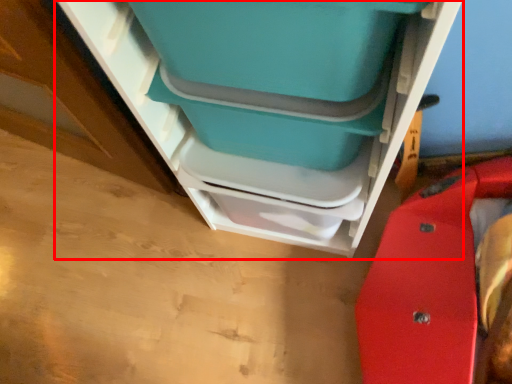
Question: Observing the image, what is the correct spatial positioning of furniture (annotated by the red box) in reference to turquoise?

Choices:
 (A) left
 (B) right

Answer: (B)